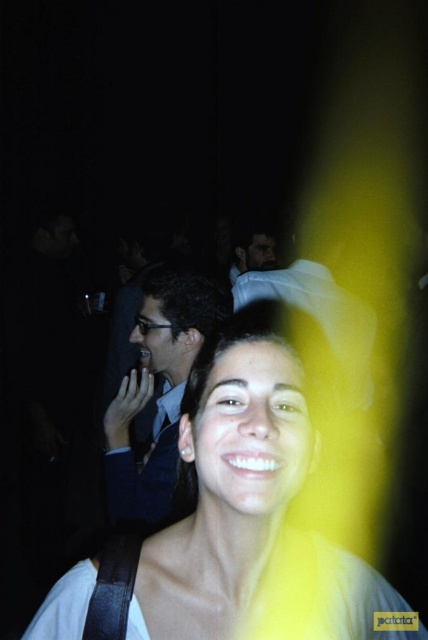
You are at a social gathering and want to take a photo of the person standing at point (258, 420). Your camera has a focal length of 50mm and a sensor size of 24mm. What is the minimum distance you need to be from the person to ensure they fill the frame vertically?

The point (258, 420) is 20.14 inches from the viewer. To calculate the minimum distance, use the formula distance > sensor size multiplied by distance from viewer divided by focal length. Plugging in the numbers, distance > 24mm x 20.14 inches divided by 50mm. This results in approximately 9.67 inches. Therefore, you need to be closer than 9.67 inches to ensure the person fills the frame vertically.

You are a photographer adjusting lighting for a portrait. You notice the white matte face at center and the matte white shirt at center in your frame. Which object appears wider in the photo?

The white matte face at center appears wider than the matte white shirt at center because its width surpasses the shirt.